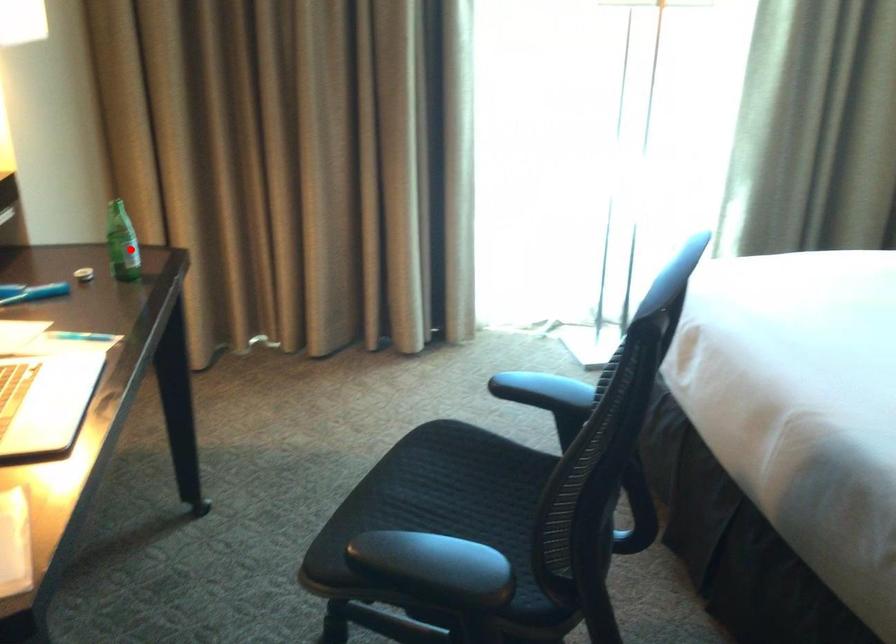
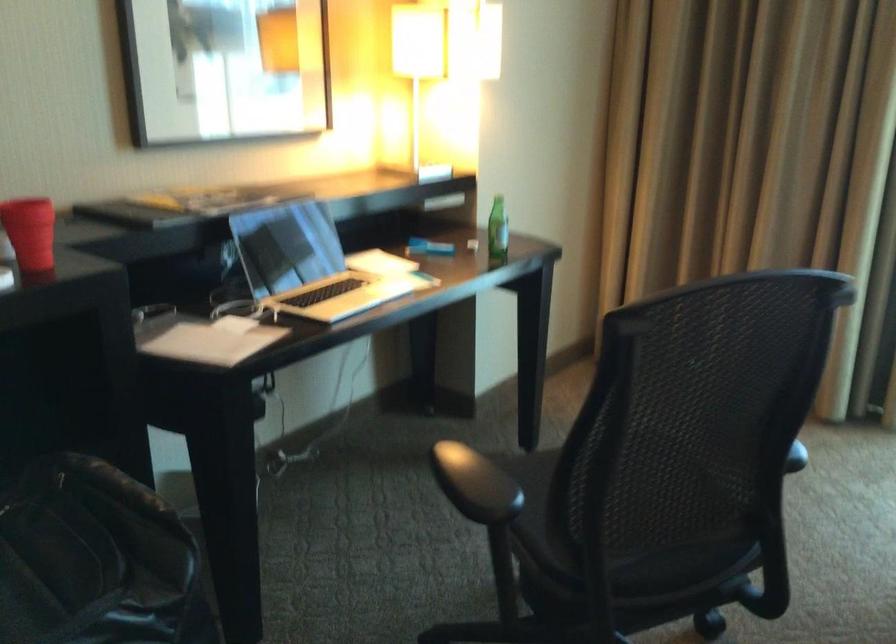
Question: I am providing you with two images of the same scene from different viewpoints. In image1, a red point is highlighted. Considering the same 3D point in image2, which of the following is correct?

Choices:
 (A) It is closer
 (B) It is farther

Answer: (B)